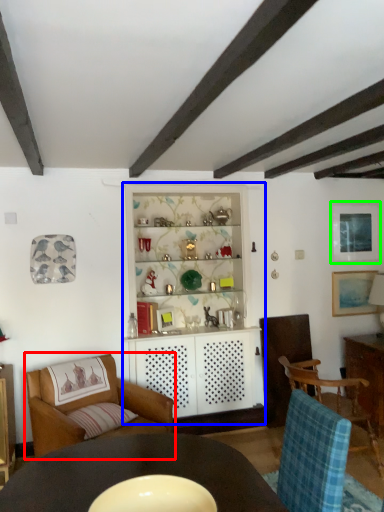
Question: Based on their relative distances, which object is nearer to chair (highlighted by a red box)? Choose from dresser (highlighted by a blue box) and picture frame (highlighted by a green box).

Choices:
 (A) dresser
 (B) picture frame

Answer: (A)